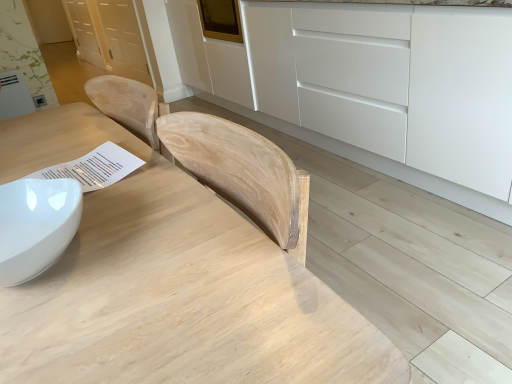
This screenshot has height=384, width=512. I want to click on natural wood table at center, so click(x=170, y=284).

What do you see at coordinates (170, 284) in the screenshot?
I see `natural wood table at center` at bounding box center [170, 284].

What are the coordinates of `white matte cabinet at center` in the screenshot? It's located at (400, 95).

This screenshot has height=384, width=512. What do you see at coordinates (400, 95) in the screenshot? I see `white matte cabinet at center` at bounding box center [400, 95].

Where is `natural wood table at center`? This screenshot has height=384, width=512. natural wood table at center is located at coordinates (170, 284).

Based on the photo, does natural wood table at center appear on the left side of white matte cabinet at center?

Correct, you'll find natural wood table at center to the left of white matte cabinet at center.

Is natural wood table at center further to the viewer compared to white matte cabinet at center?

No, it is not.

Is point (96, 346) behind point (456, 176)?

No.

From the image's perspective, is natural wood table at center above white matte cabinet at center?

No, from the image's perspective, natural wood table at center is not over white matte cabinet at center.

From a real-world perspective, who is located lower, natural wood table at center or white matte cabinet at center?

white matte cabinet at center is physically lower.

Is natural wood table at center wider than white matte cabinet at center?

No.

From their relative heights in the image, would you say natural wood table at center is taller or shorter than white matte cabinet at center?

natural wood table at center is shorter than white matte cabinet at center.

Can you confirm if natural wood table at center is smaller than white matte cabinet at center?

Correct, natural wood table at center occupies less space than white matte cabinet at center.

Is white matte cabinet at center a part of natural wood table at center?

Actually, white matte cabinet at center is outside natural wood table at center.

Is natural wood table at center with white matte cabinet at center?

No, natural wood table at center is not next to white matte cabinet at center.

Does natural wood table at center turn towards white matte cabinet at center?

No, natural wood table at center is not turned towards white matte cabinet at center.

What's the angular difference between natural wood table at center and white matte cabinet at center's facing directions?

0.984 degrees.

Find the location of a particular element. This screenshot has width=512, height=384. table above the white matte cabinet at center (from a real-world perspective) is located at coordinates (170, 284).

Which object is positioned more to the right, white matte cabinet at center or natural wood table at center?

white matte cabinet at center is more to the right.

Considering the positions of objects white matte cabinet at center and natural wood table at center in the image provided, who is behind, white matte cabinet at center or natural wood table at center?

white matte cabinet at center.

Considering the points (449, 135) and (191, 193), which point is in front, point (449, 135) or point (191, 193)?

Positioned in front is point (191, 193).

From the image's perspective, is white matte cabinet at center above natural wood table at center?

Yes.

From a real-world perspective, which object rests below the other?

white matte cabinet at center.

Looking at this image, looking at their sizes, would you say white matte cabinet at center is wider or thinner than natural wood table at center?

In the image, white matte cabinet at center appears to be wider than natural wood table at center.

Does white matte cabinet at center have a greater height compared to natural wood table at center?

Yes.

Considering the sizes of objects white matte cabinet at center and natural wood table at center in the image provided, who is bigger, white matte cabinet at center or natural wood table at center?

With larger size is white matte cabinet at center.

Is white matte cabinet at center outside of natural wood table at center?

Yes, white matte cabinet at center is not within natural wood table at center.

Is white matte cabinet at center beside natural wood table at center?

There is a gap between white matte cabinet at center and natural wood table at center.

Could you tell me if white matte cabinet at center is turned towards natural wood table at center?

Yes.

Measure the distance between white matte cabinet at center and natural wood table at center.

They are 1.39 meters apart.

At what (x,y) coordinates should I click in order to perform the action: click on table located on the left of white matte cabinet at center. Please return your answer as a coordinate pair (x, y). The image size is (512, 384). Looking at the image, I should click on (170, 284).

Locate an element on the screen. The image size is (512, 384). table located below the white matte cabinet at center (from the image's perspective) is located at coordinates (170, 284).

Identify the location of cabinetry above the natural wood table at center (from the image's perspective). This screenshot has height=384, width=512. (400, 95).